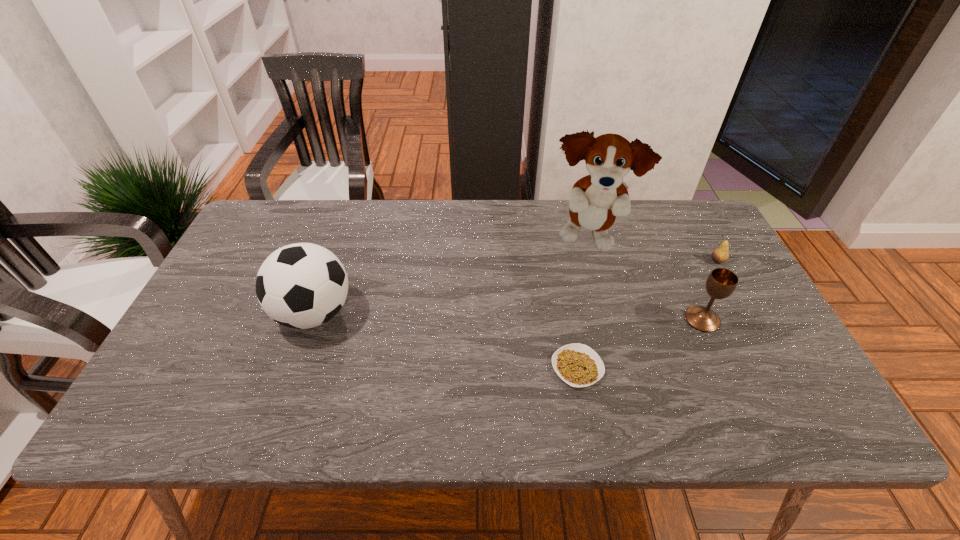
The image size is (960, 540). In the image, there is a desktop. In order to click on free space at the far left corner in this screenshot , I will do `click(278, 221)`.

The image size is (960, 540). What are the coordinates of `vacant space at the far right corner of the desktop` in the screenshot? It's located at (692, 240).

Image resolution: width=960 pixels, height=540 pixels. I want to click on vacant space at the near right corner of the desktop, so click(x=782, y=433).

Where is `vacant area that lies between the chalice and the fourth shortest object`? vacant area that lies between the chalice and the fourth shortest object is located at coordinates (509, 316).

You are a GUI agent. You are given a task and a screenshot of the screen. Output one action in this format:
    pyautogui.click(x=<x>, y=<y>)
    Task: Click on the free area in between the tallest object and the leftmost object
    The height and width of the screenshot is (540, 960).
    Given the screenshot: What is the action you would take?
    pyautogui.click(x=451, y=277)

In order to click on empty location between the second tallest object and the third shortest object in this screenshot , I will do `click(509, 316)`.

Identify the location of empty location between the tallest object and the pear. (652, 251).

Find the location of a particular element. empty space between the shortest object and the third shortest object is located at coordinates (639, 343).

Image resolution: width=960 pixels, height=540 pixels. In order to click on vacant area between the second tallest object and the rightmost object in this screenshot , I will do `click(516, 287)`.

Locate an element on the screen. free space that is in between the third shortest object and the tallest object is located at coordinates (645, 280).